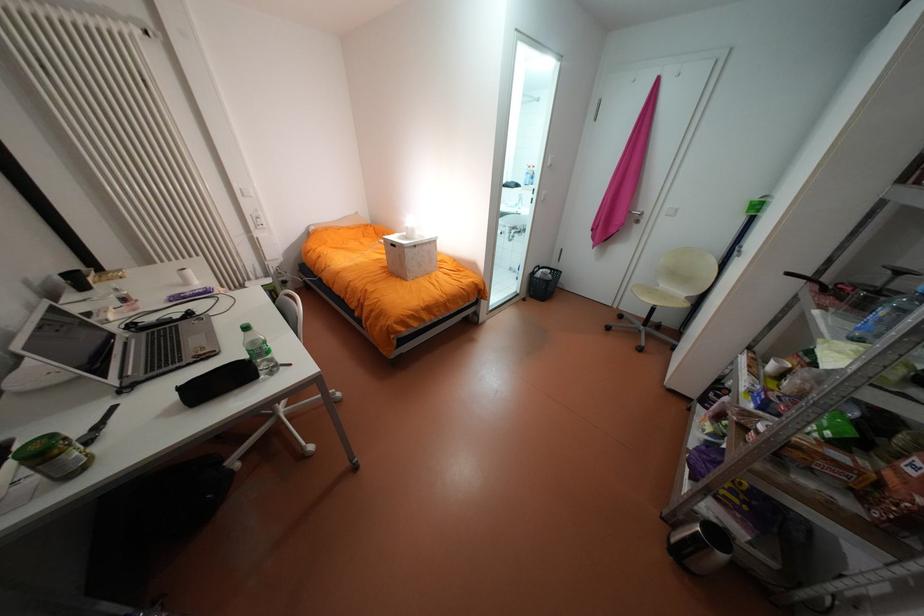
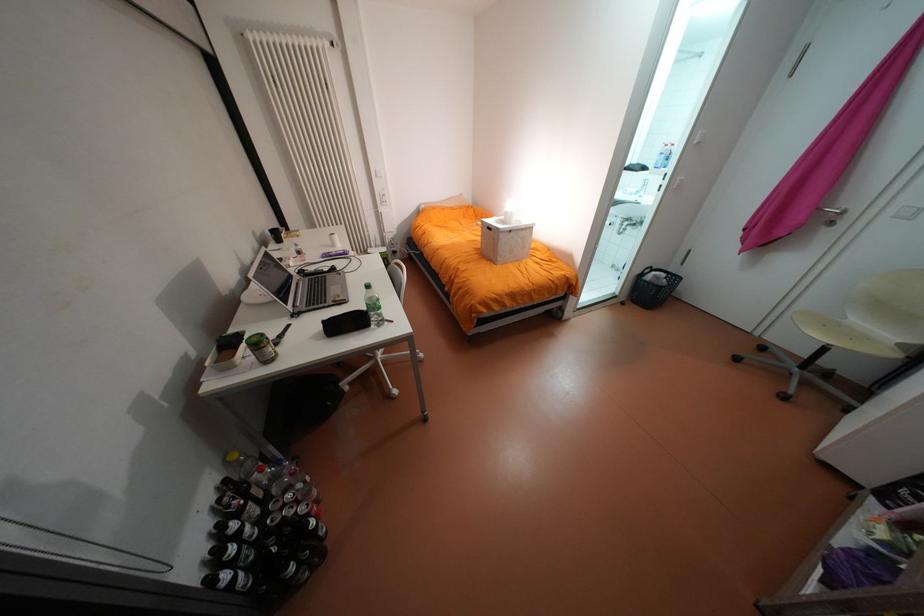
Locate, in the second image, the point that corresponds to pixel 266 376 in the first image.

(379, 325)